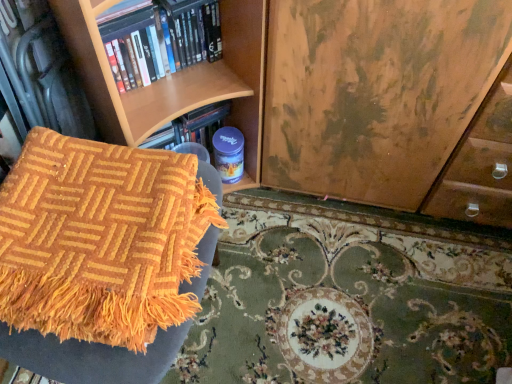
Question: Looking at their shapes, would you say orange woven blanket at lower left is wider or thinner than hardcover books at upper left?

Choices:
 (A) thin
 (B) wide

Answer: (B)

Question: Is orange woven blanket at lower left taller or shorter than hardcover books at upper left?

Choices:
 (A) short
 (B) tall

Answer: (A)

Question: Which object is the farthest from the orange woven mat at lower left?

Choices:
 (A) orange woven blanket at lower left
 (B) hardcover books at upper left

Answer: (B)

Question: Which of these objects is positioned farthest from the hardcover books at upper left?

Choices:
 (A) orange woven blanket at lower left
 (B) orange woven mat at lower left

Answer: (B)